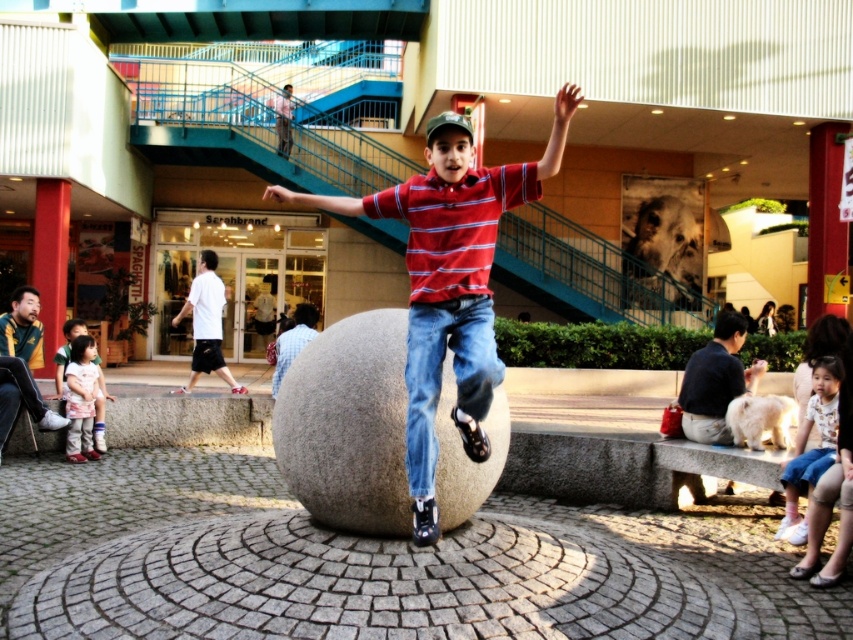
You are a photographer trying to capture the boy jumping on the gray stone sphere. You notice the blue denim jeans at center and the light blue denim shorts at lower right in your frame. Which clothing item is closer to the camera?

The blue denim jeans at center is closer to the camera because it is in front of the light blue denim shorts at lower right.

What are the coordinates of the light blue denim shorts at lower right?

The light blue denim shorts at lower right are located at coordinates point (813, 448).